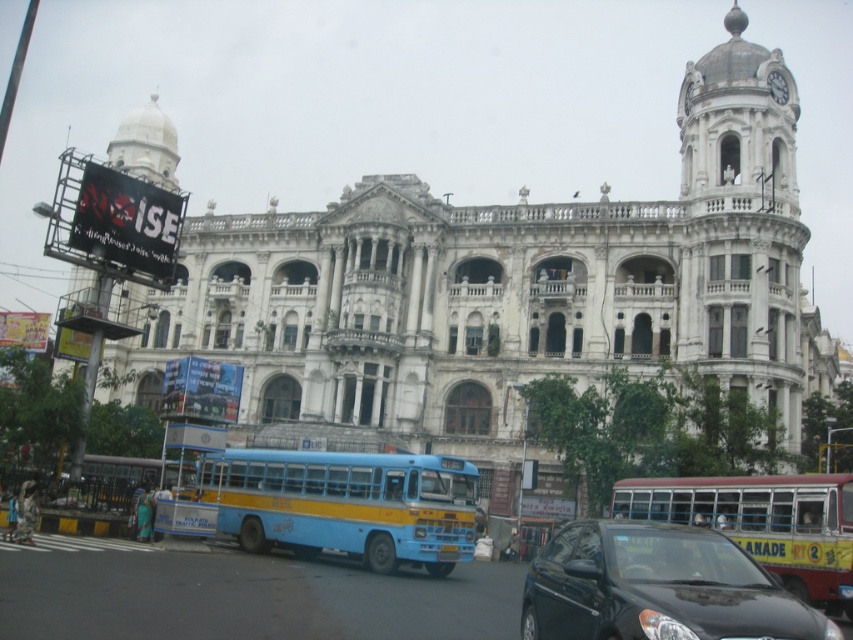
You are a pedestrian standing on the sidewalk in front of the grand historic building. You see a blue matte bus at center and a yellow painted bus at center. Which bus is shorter in height?

The blue matte bus at center is shorter in height compared to the yellow painted bus at center.

You are a pedestrian standing on the sidewalk in front of the historic building. You see a shiny black car at center and a yellow painted bus at center. Which vehicle is closer to you?

The shiny black car at center is closer to you because it is in front of the yellow painted bus at center.